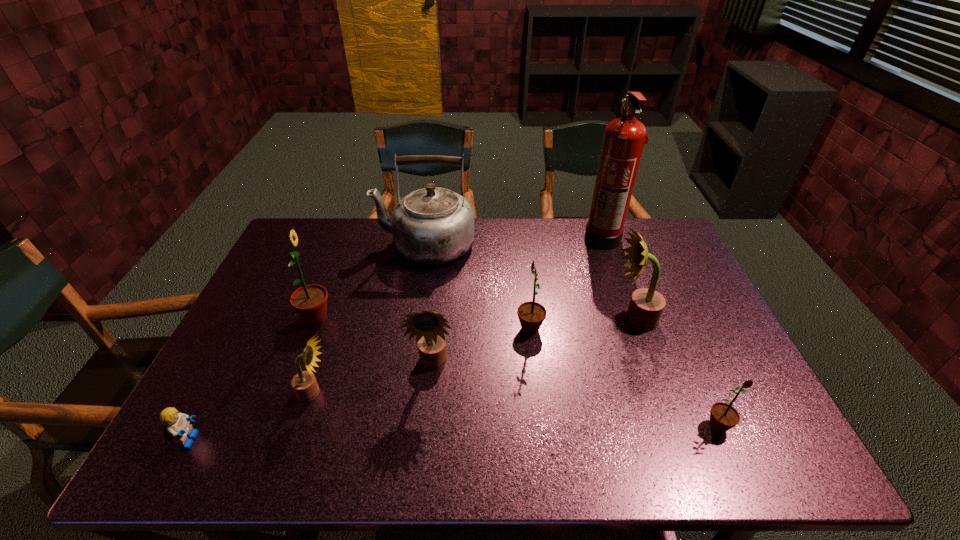
Find the location of a particular element. The image size is (960, 540). fire extinguisher that is at the far edge is located at coordinates (624, 138).

Locate an element on the screen. kettle situated at the far edge is located at coordinates (433, 225).

The image size is (960, 540). I want to click on sunflower at the near edge, so click(723, 416).

I want to click on Lego located in the near edge section of the desktop, so click(177, 426).

Find the location of a particular element. The height and width of the screenshot is (540, 960). sunflower present at the left edge is located at coordinates (310, 301).

You are a GUI agent. You are given a task and a screenshot of the screen. Output one action in this format:
    pyautogui.click(x=<x>, y=<y>)
    Task: Click on the Lego situated at the left edge
    This screenshot has width=960, height=540.
    Given the screenshot: What is the action you would take?
    click(x=177, y=426)

What are the coordinates of `object at the right edge` in the screenshot? It's located at (723, 416).

At what (x,y) coordinates should I click in order to perform the action: click on object positioned at the near left corner. Please return your answer as a coordinate pair (x, y). This screenshot has height=540, width=960. Looking at the image, I should click on (177, 426).

Where is `object positioned at the near right corner`? object positioned at the near right corner is located at coordinates (723, 416).

At what (x,y) coordinates should I click in order to perform the action: click on vacant space at the far edge of the desktop. Please return your answer as a coordinate pair (x, y). Looking at the image, I should click on (533, 238).